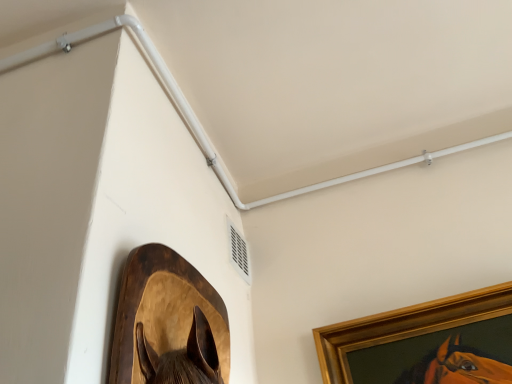
Question: Based on their sizes in the image, would you say white plastic air conditioning unit at upper center is bigger or smaller than wooden horse head at lower left, acting as the first picture frame starting from the left?

Choices:
 (A) small
 (B) big

Answer: (A)

Question: Is white plastic air conditioning unit at upper center wider or thinner than wooden horse head at lower left, acting as the first picture frame starting from the left?

Choices:
 (A) thin
 (B) wide

Answer: (A)

Question: Which object is positioned closest to the wooden horse head at lower left, acting as the first picture frame starting from the left?

Choices:
 (A) white plastic pipe at upper center
 (B) gold wooden picture frame at upper right, the second picture frame positioned from the left
 (C) white plastic air conditioning unit at upper center

Answer: (C)

Question: Estimate the real-world distances between objects in this image. Which object is farther from the white plastic pipe at upper center?

Choices:
 (A) gold wooden picture frame at upper right, arranged as the first picture frame when viewed from the back
 (B) wooden horse head at lower left, arranged as the 2th picture frame when viewed from the right
 (C) white plastic air conditioning unit at upper center

Answer: (B)